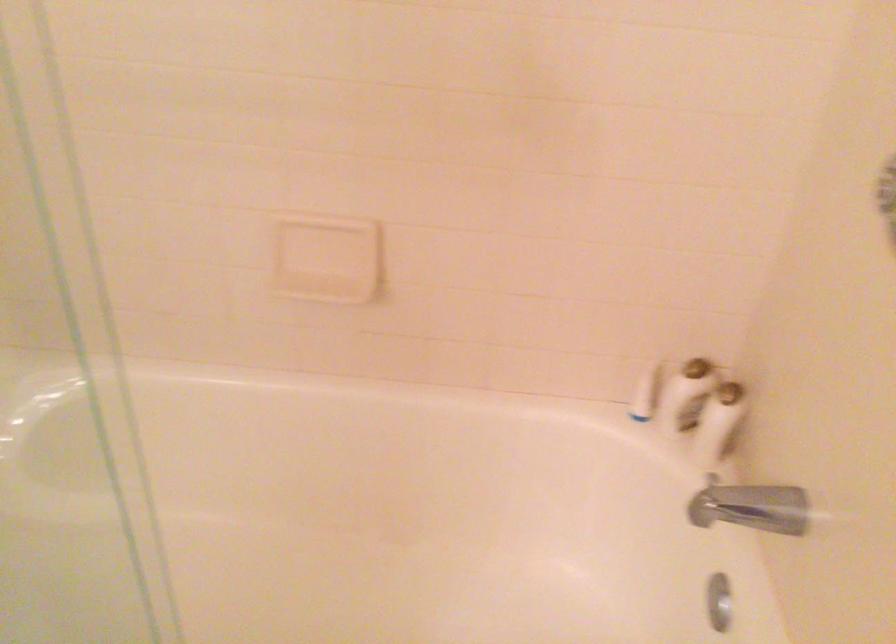
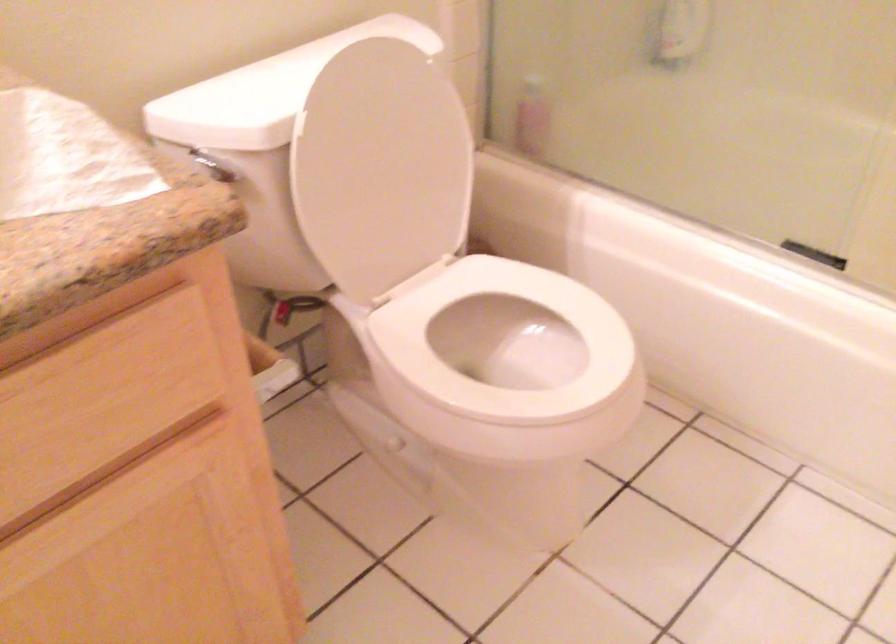
Question: The camera is either moving clockwise (left) or counter-clockwise (right) around the object. The first image is from the beginning of the video and the second image is from the end. Is the camera moving left or right when shooting the video?

Choices:
 (A) Left
 (B) Right

Answer: (B)